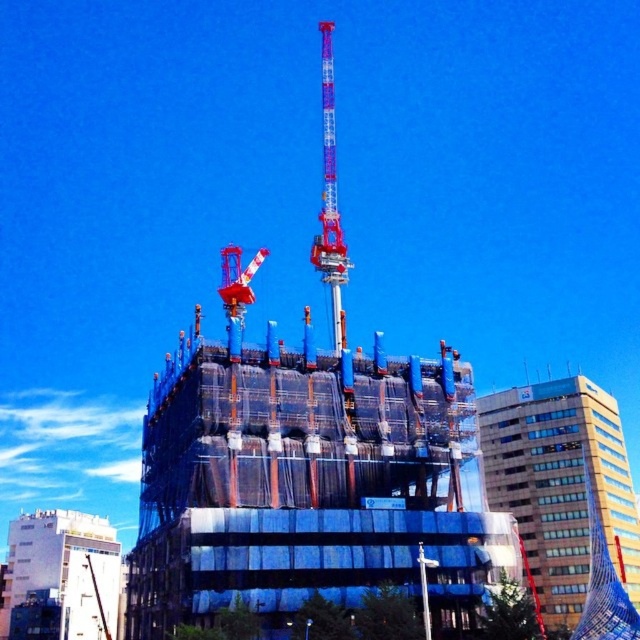
Does white matte building at lower left appear on the left side of metallic blue tower crane at center?

Yes, white matte building at lower left is to the left of metallic blue tower crane at center.

Can you confirm if white matte building at lower left is positioned below metallic blue tower crane at center?

Correct, white matte building at lower left is located below metallic blue tower crane at center.

Identify the location of white matte building at lower left. click(60, 577).

Does blue glass building at center have a larger size compared to white matte building at lower left?

Indeed, blue glass building at center has a larger size compared to white matte building at lower left.

Does blue glass building at center have a greater height compared to white matte building at lower left?

Yes.

Is point (561, 516) in front of point (77, 525)?

Yes, it is in front of point (77, 525).

Where is `blue glass building at center`? The image size is (640, 640). blue glass building at center is located at coordinates (561, 486).

Between blue glass building at center and metallic blue tower crane at center, which one is positioned higher?

metallic blue tower crane at center is above.

Between blue glass building at center and metallic blue tower crane at center, which one appears on the right side from the viewer's perspective?

blue glass building at center

Between point (580, 509) and point (326, 228), which one is positioned in front?

Point (326, 228)

Identify the location of blue glass building at center. The height and width of the screenshot is (640, 640). (561, 486).